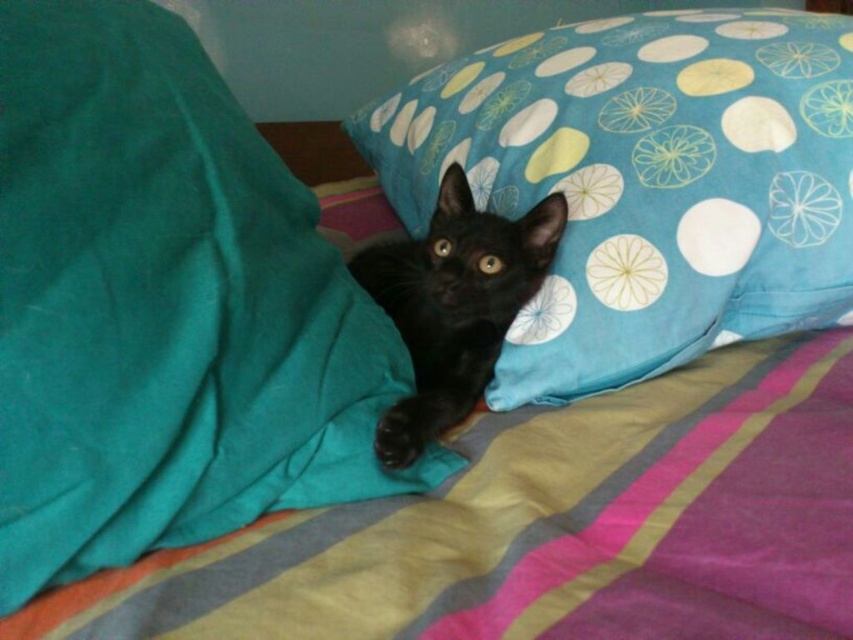
You are a photographer trying to capture the black glossy cat at center. You want to adjust the lighting so that the blue dotted pillow at upper right is fully visible in the frame. Which direction should you move the pillow to ensure it stays to the right of the cat but becomes more visible?

Move the blue dotted pillow at upper right slightly to the right of its current position so it remains on the right side of the black glossy cat at center while becoming more visible in the frame.

Looking at this image, you are a photographer setting up a shot of the black glossy cat at center. You want to ensure the blue dotted pillow at upper right is visible in the background. Based on the scene, can you confirm if the pillow is positioned in a way that it will appear behind the cat in the photo?

The blue dotted pillow at upper right is located above the black glossy cat at center, so yes, it will appear behind the cat in the photo as it is positioned above and likely in the background.

You are a photographer setting up a shot of the black kitten lying on the bed. The blue dotted pillow at upper right is part of the scene. Where should you place your camera to capture the pillow in the upper right corner of the photo?

The blue dotted pillow at upper right is located at point (643, 182), so you should position your camera to frame the pillow near the upper right corner of the photo at those coordinates.